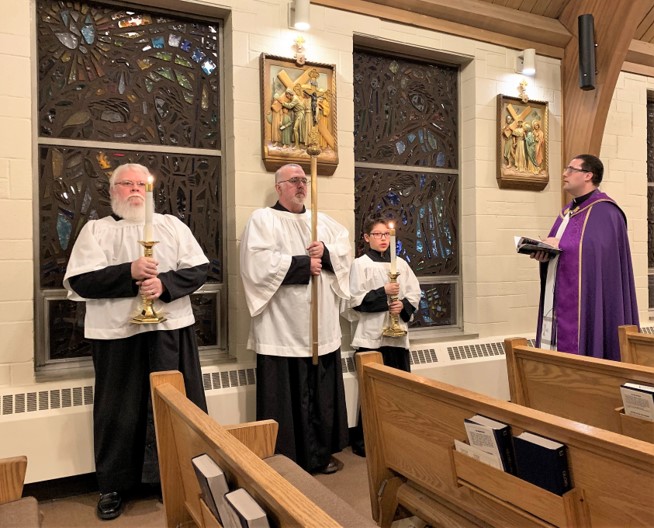
Image resolution: width=654 pixels, height=528 pixels. Find the location of `robe`. robe is located at coordinates (598, 238).